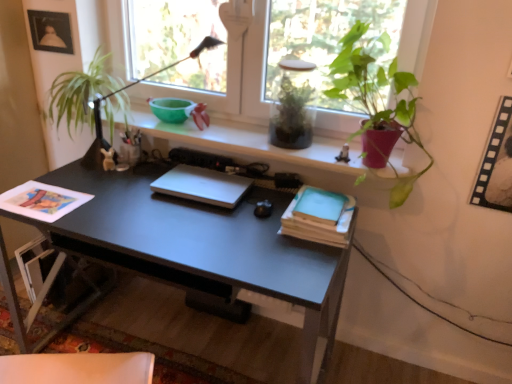
The height and width of the screenshot is (384, 512). Find the location of `free space that is in between light blue paper at center right, the 1th paperback book ordered from the bottom, and white matte laptop at center`. free space that is in between light blue paper at center right, the 1th paperback book ordered from the bottom, and white matte laptop at center is located at coordinates (247, 211).